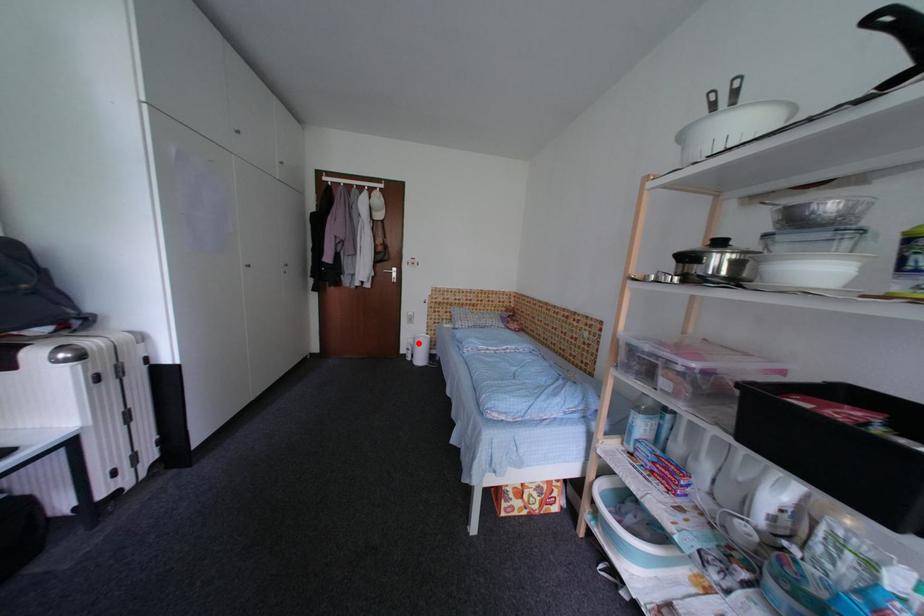
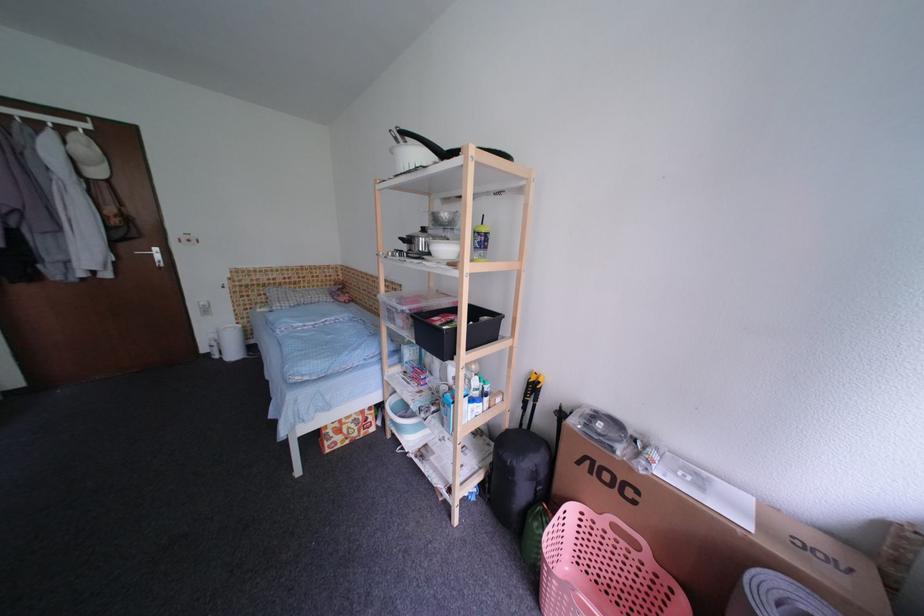
Question: I am providing you with two images of the same scene from different viewpoints. A red point is shown in image1. For the corresponding object point in image2, is it positioned nearer or farther from the camera?

Choices:
 (A) Nearer
 (B) Farther

Answer: (A)